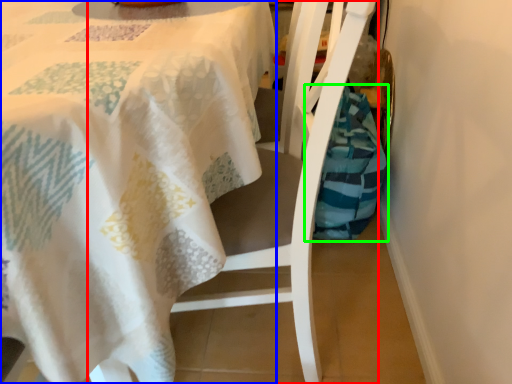
Question: Which object is the closest to the chair (highlighted by a red box)? Choose among these: tablecloth (highlighted by a blue box) or material (highlighted by a green box).

Choices:
 (A) tablecloth
 (B) material

Answer: (A)